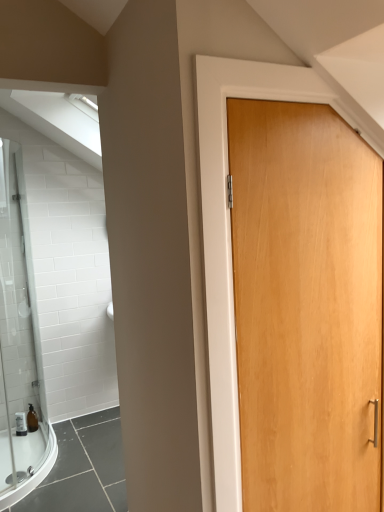
Question: Should I look upward or downward to see translucent amber bottle at lower left?

Choices:
 (A) down
 (B) up

Answer: (A)

Question: Is light brown wood door at center outside translucent amber bottle at lower left?

Choices:
 (A) yes
 (B) no

Answer: (A)

Question: Can you confirm if light brown wood door at center is positioned to the left of translucent amber bottle at lower left?

Choices:
 (A) yes
 (B) no

Answer: (B)

Question: Is light brown wood door at center directly adjacent to translucent amber bottle at lower left?

Choices:
 (A) yes
 (B) no

Answer: (B)

Question: Is light brown wood door at center turned away from translucent amber bottle at lower left?

Choices:
 (A) no
 (B) yes

Answer: (B)

Question: Is light brown wood door at center at the right side of translucent amber bottle at lower left?

Choices:
 (A) yes
 (B) no

Answer: (A)

Question: From a real-world perspective, is light brown wood door at center physically below translucent amber bottle at lower left?

Choices:
 (A) yes
 (B) no

Answer: (B)

Question: Considering the relative sizes of translucent amber bottle at lower left and light brown wood door at center in the image provided, is translucent amber bottle at lower left bigger than light brown wood door at center?

Choices:
 (A) no
 (B) yes

Answer: (A)

Question: From a real-world perspective, does translucent amber bottle at lower left stand above light brown wood door at center?

Choices:
 (A) yes
 (B) no

Answer: (B)

Question: Is translucent amber bottle at lower left oriented away from light brown wood door at center?

Choices:
 (A) no
 (B) yes

Answer: (A)

Question: Can you confirm if translucent amber bottle at lower left is taller than light brown wood door at center?

Choices:
 (A) no
 (B) yes

Answer: (A)

Question: Is translucent amber bottle at lower left closer to the viewer compared to light brown wood door at center?

Choices:
 (A) yes
 (B) no

Answer: (B)

Question: Considering the relative sizes of translucent amber bottle at lower left and light brown wood door at center in the image provided, is translucent amber bottle at lower left wider than light brown wood door at center?

Choices:
 (A) no
 (B) yes

Answer: (B)

Question: From the image's perspective, is translucent amber bottle at lower left located above or below light brown wood door at center?

Choices:
 (A) above
 (B) below

Answer: (B)